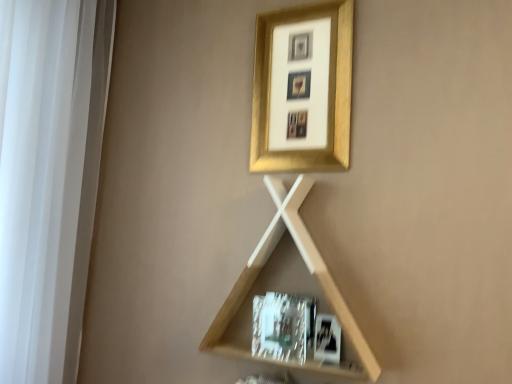
Question: From a real-world perspective, is gold metallic picture frame at upper center, which appears as the 1th picture frame when viewed from the top, positioned under metallic silver picture frame at lower right, the 1th picture frame when ordered from front to back, based on gravity?

Choices:
 (A) no
 (B) yes

Answer: (A)

Question: Is gold metallic picture frame at upper center, positioned as the second picture frame in front-to-back order, oriented towards metallic silver picture frame at lower right, the 1th picture frame when ordered from front to back?

Choices:
 (A) yes
 (B) no

Answer: (B)

Question: Is gold metallic picture frame at upper center, positioned as the 1th picture frame in back-to-front order, smaller than metallic silver picture frame at lower right, which is the first picture frame from bottom to top?

Choices:
 (A) yes
 (B) no

Answer: (B)

Question: From the image's perspective, would you say gold metallic picture frame at upper center, positioned as the second picture frame in front-to-back order, is positioned over metallic silver picture frame at lower right, positioned as the 2th picture frame in top-to-bottom order?

Choices:
 (A) no
 (B) yes

Answer: (B)

Question: Is gold metallic picture frame at upper center, positioned as the second picture frame in front-to-back order, at the right side of metallic silver picture frame at lower right, which is the first picture frame from bottom to top?

Choices:
 (A) no
 (B) yes

Answer: (A)

Question: Is gold metallic picture frame at upper center, positioned as the second picture frame in front-to-back order, in front of or behind light wood/texture shelf at center in the image?

Choices:
 (A) behind
 (B) front

Answer: (A)

Question: In the image, is gold metallic picture frame at upper center, which appears as the 1th picture frame when viewed from the top, on the left side or the right side of light wood/texture shelf at center?

Choices:
 (A) left
 (B) right

Answer: (B)

Question: Looking at their shapes, would you say gold metallic picture frame at upper center, which appears as the 1th picture frame when viewed from the top, is wider or thinner than light wood/texture shelf at center?

Choices:
 (A) thin
 (B) wide

Answer: (A)

Question: From the image's perspective, is gold metallic picture frame at upper center, which appears as the 1th picture frame when viewed from the top, positioned above or below light wood/texture shelf at center?

Choices:
 (A) below
 (B) above

Answer: (B)

Question: Considering the positions of white fabric at left and light wood/texture shelf at center in the image, is white fabric at left wider or thinner than light wood/texture shelf at center?

Choices:
 (A) thin
 (B) wide

Answer: (B)

Question: From the image's perspective, is white fabric at left above or below light wood/texture shelf at center?

Choices:
 (A) above
 (B) below

Answer: (A)

Question: Based on their sizes in the image, would you say white fabric at left is bigger or smaller than light wood/texture shelf at center?

Choices:
 (A) small
 (B) big

Answer: (B)

Question: Is point (59, 74) positioned closer to the camera than point (226, 314)?

Choices:
 (A) closer
 (B) farther

Answer: (B)

Question: From their relative heights in the image, would you say white fabric at left is taller or shorter than metallic silver picture frame at lower right, positioned as the 2th picture frame in top-to-bottom order?

Choices:
 (A) short
 (B) tall

Answer: (B)

Question: Do you think white fabric at left is within metallic silver picture frame at lower right, the second picture frame in the back-to-front sequence, or outside of it?

Choices:
 (A) inside
 (B) outside

Answer: (B)